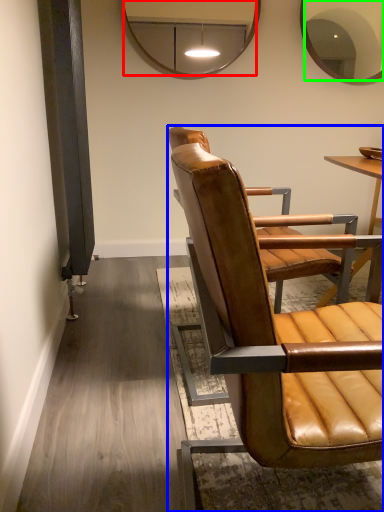
Question: Which object is the closest to the mirror (highlighted by a red box)? Choose among these: chair (highlighted by a blue box) or mirror (highlighted by a green box).

Choices:
 (A) chair
 (B) mirror

Answer: (B)